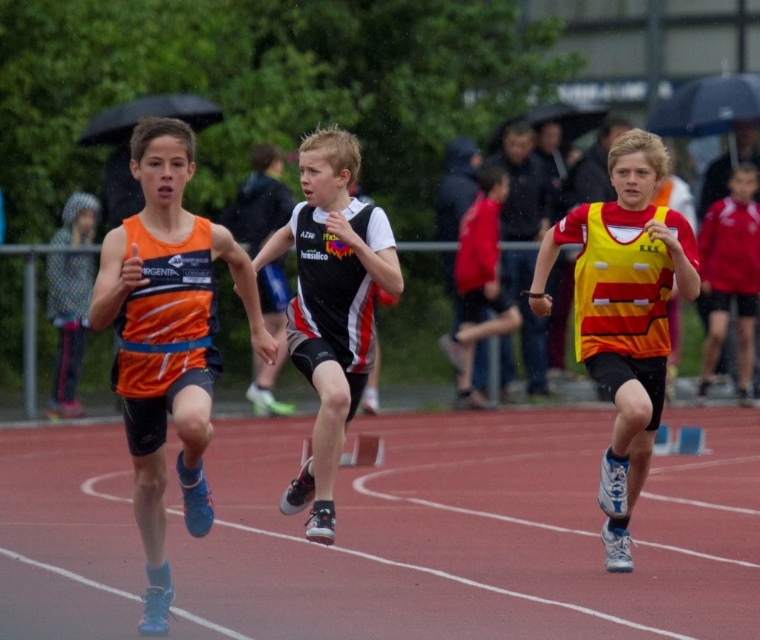
You are a photographer at the track and field event. You need to capture a photo that includes both the red rubber track at center and the black and white jersey at center. Which object should be placed closer to the bottom of the frame to ensure both are visible?

The red rubber track at center is shorter than the black and white jersey at center, so place the red rubber track at center closer to the bottom of the frame to ensure both are visible.